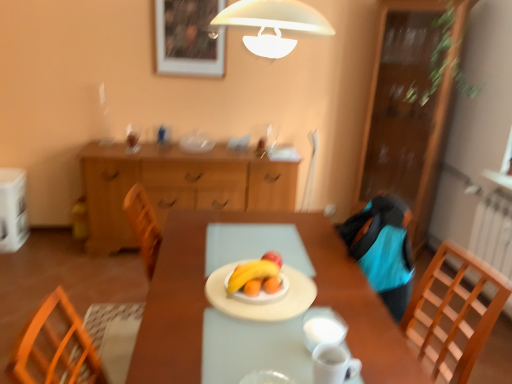
This screenshot has height=384, width=512. Find the location of `vacant space in front of shiny red apple at center`. vacant space in front of shiny red apple at center is located at coordinates (279, 298).